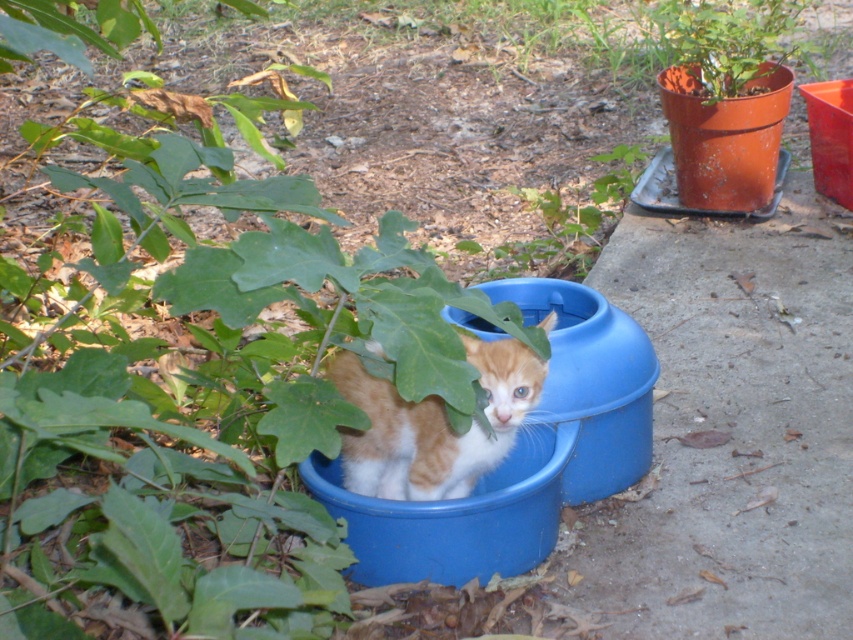
Question: Which object appears closest to the camera in this image?

Choices:
 (A) matte orange pot at upper right
 (B) orange fur kitten at center
 (C) green leafy plant at upper center

Answer: (B)

Question: From the image, what is the correct spatial relationship of matte orange pot at upper right in relation to green leafy plant at upper center?

Choices:
 (A) left
 (B) right

Answer: (B)

Question: Which is farther from the green leafy plant at upper center?

Choices:
 (A) matte orange pot at upper right
 (B) orange fur kitten at center

Answer: (B)

Question: Is orange fur kitten at center smaller than matte orange pot at upper right?

Choices:
 (A) no
 (B) yes

Answer: (B)

Question: Is orange fur kitten at center positioned behind matte orange pot at upper right?

Choices:
 (A) no
 (B) yes

Answer: (A)

Question: Among these points, which one is farthest from the camera?

Choices:
 (A) (351, 449)
 (B) (576, 244)

Answer: (B)